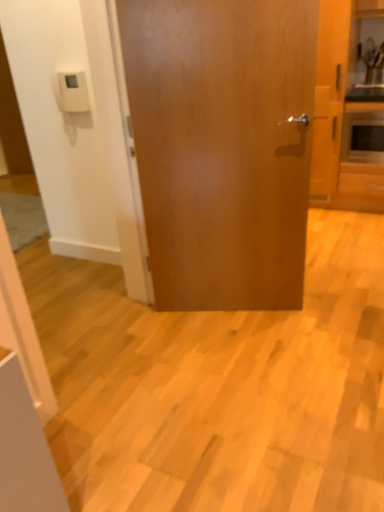
Question: From the image's perspective, does wooden cabinet at right appear lower than glossy wood door at center?

Choices:
 (A) yes
 (B) no

Answer: (B)

Question: Is wooden cabinet at right turned away from glossy wood door at center?

Choices:
 (A) no
 (B) yes

Answer: (A)

Question: From a real-world perspective, is wooden cabinet at right physically above glossy wood door at center?

Choices:
 (A) no
 (B) yes

Answer: (B)

Question: Does wooden cabinet at right come behind glossy wood door at center?

Choices:
 (A) yes
 (B) no

Answer: (A)

Question: From the image's perspective, is wooden cabinet at right over glossy wood door at center?

Choices:
 (A) no
 (B) yes

Answer: (B)

Question: Can you confirm if wooden cabinet at right is wider than glossy wood door at center?

Choices:
 (A) no
 (B) yes

Answer: (B)

Question: From the image's perspective, is glossy wood door at center under wooden cabinet at right?

Choices:
 (A) yes
 (B) no

Answer: (A)

Question: From a real-world perspective, is glossy wood door at center positioned over wooden cabinet at right based on gravity?

Choices:
 (A) no
 (B) yes

Answer: (A)

Question: Does glossy wood door at center come behind wooden cabinet at right?

Choices:
 (A) no
 (B) yes

Answer: (A)

Question: Is glossy wood door at center smaller than wooden cabinet at right?

Choices:
 (A) yes
 (B) no

Answer: (A)

Question: Considering the relative sizes of glossy wood door at center and wooden cabinet at right in the image provided, is glossy wood door at center wider than wooden cabinet at right?

Choices:
 (A) yes
 (B) no

Answer: (B)

Question: Considering the relative sizes of glossy wood door at center and wooden cabinet at right in the image provided, is glossy wood door at center thinner than wooden cabinet at right?

Choices:
 (A) yes
 (B) no

Answer: (A)

Question: Is glossy wood door at center aimed at matte silver microwave at right?

Choices:
 (A) no
 (B) yes

Answer: (A)